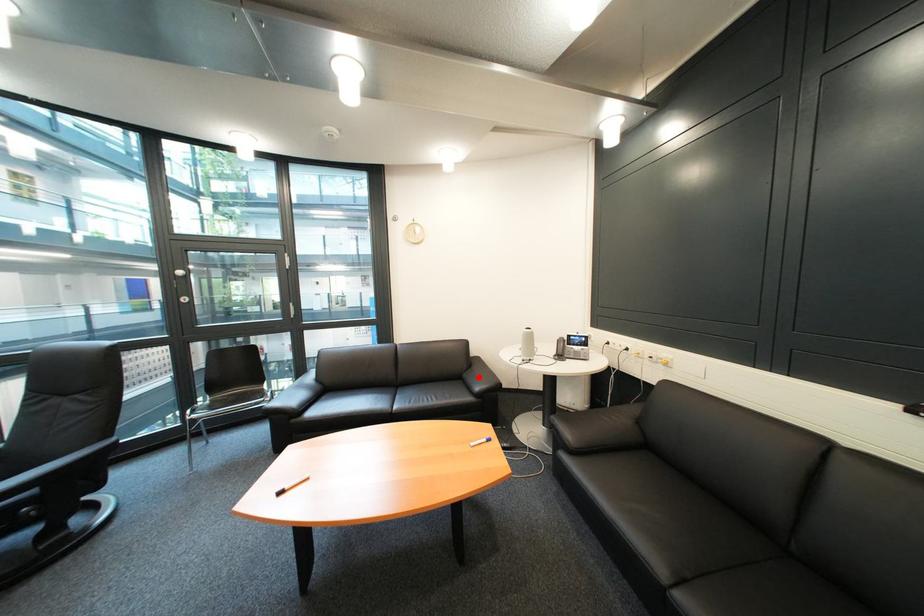
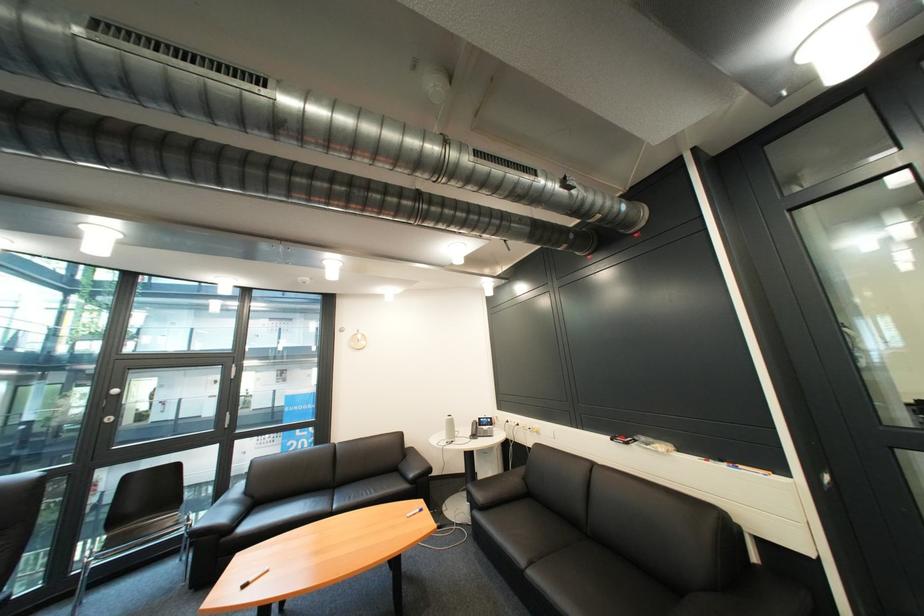
Question: I am providing you with two images of the same scene from different viewpoints. Given a red point in image1, look at the same physical point in image2. Is it:

Choices:
 (A) Closer to the viewpoint
 (B) Farther from the viewpoint

Answer: (A)